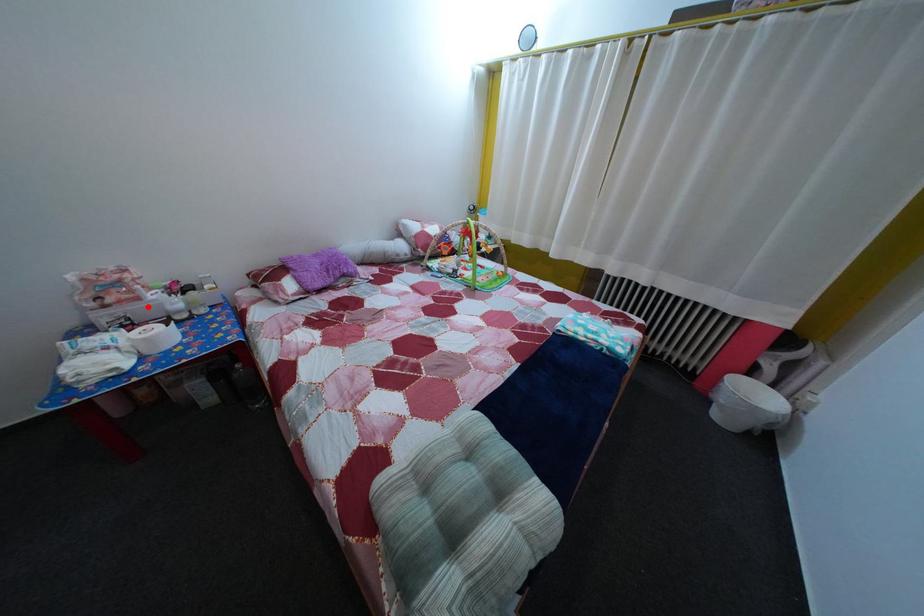
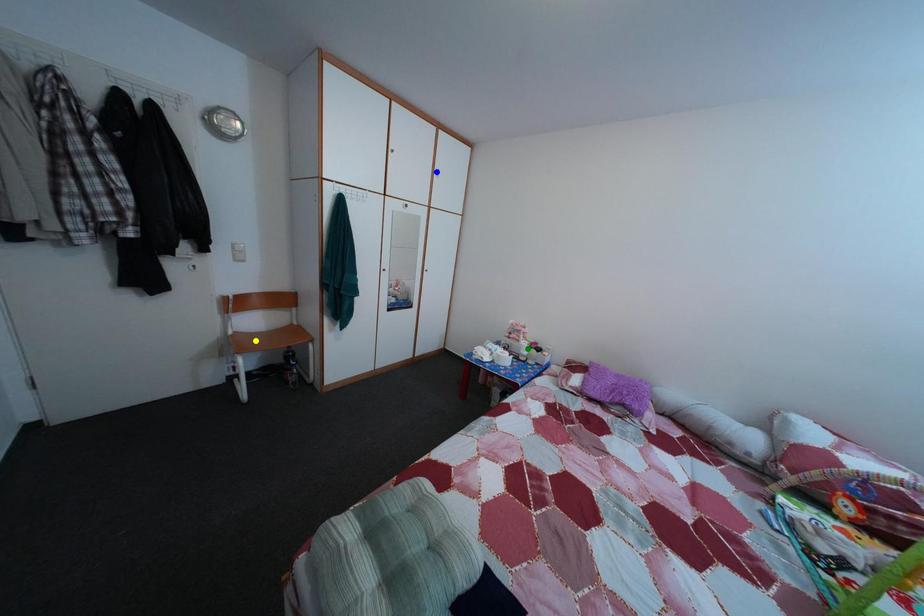
Question: I am providing you with two images of the same scene from different viewpoints. A red point is marked on the first image. You are given multiple points on the second image. Which point in image 2 is actually the same real-world point as the red point in image 1?

Choices:
 (A) blue point
 (B) yellow point
 (C) green point

Answer: (C)